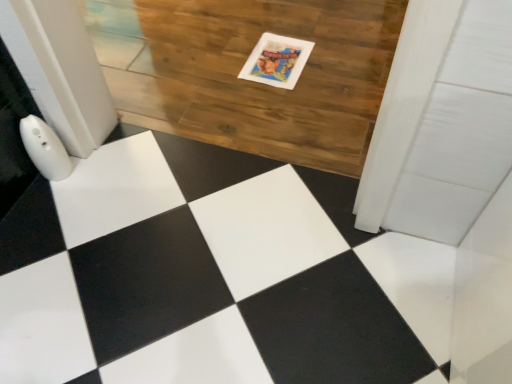
Question: Should I look upward or downward to see matte paper postcard at upper center?

Choices:
 (A) down
 (B) up

Answer: (B)

Question: Does wooden floor at center contain matte paper postcard at upper center?

Choices:
 (A) no
 (B) yes

Answer: (B)

Question: Is wooden floor at center aimed at matte paper postcard at upper center?

Choices:
 (A) no
 (B) yes

Answer: (B)

Question: Is wooden floor at center not inside matte paper postcard at upper center?

Choices:
 (A) yes
 (B) no

Answer: (A)

Question: Does wooden floor at center have a greater height compared to matte paper postcard at upper center?

Choices:
 (A) yes
 (B) no

Answer: (A)

Question: Does wooden floor at center lie behind matte paper postcard at upper center?

Choices:
 (A) no
 (B) yes

Answer: (A)

Question: Is matte paper postcard at upper center at the back of wooden floor at center?

Choices:
 (A) yes
 (B) no

Answer: (A)

Question: Does matte paper postcard at upper center appear on the left side of wooden floor at center?

Choices:
 (A) yes
 (B) no

Answer: (B)

Question: Considering the relative sizes of matte paper postcard at upper center and wooden floor at center in the image provided, is matte paper postcard at upper center taller than wooden floor at center?

Choices:
 (A) yes
 (B) no

Answer: (B)

Question: Can you confirm if matte paper postcard at upper center is bigger than wooden floor at center?

Choices:
 (A) no
 (B) yes

Answer: (A)

Question: From a real-world perspective, does matte paper postcard at upper center sit lower than wooden floor at center?

Choices:
 (A) yes
 (B) no

Answer: (B)

Question: Are matte paper postcard at upper center and wooden floor at center located far from each other?

Choices:
 (A) yes
 (B) no

Answer: (B)

Question: Is matte paper postcard at upper center positioned beyond the bounds of wooden floor at center?

Choices:
 (A) no
 (B) yes

Answer: (A)

Question: Looking at their shapes, would you say wooden floor at center is wider or thinner than matte paper postcard at upper center?

Choices:
 (A) thin
 (B) wide

Answer: (B)